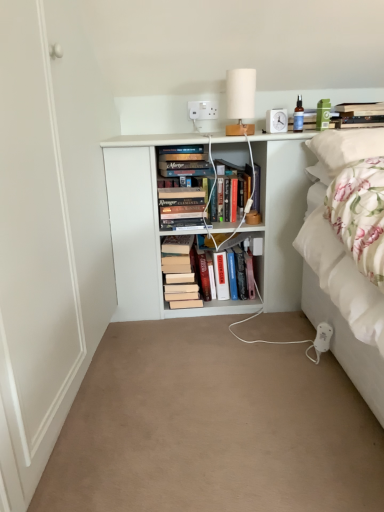
Question: Considering the relative sizes of hardcover book at center, the second book in the top-to-bottom sequence, and white fabric lampshade at upper center in the image provided, is hardcover book at center, the second book in the top-to-bottom sequence, wider than white fabric lampshade at upper center?

Choices:
 (A) yes
 (B) no

Answer: (A)

Question: Is hardcover book at center, the second book in the top-to-bottom sequence, in front of white fabric lampshade at upper center?

Choices:
 (A) no
 (B) yes

Answer: (A)

Question: From the image's perspective, does hardcover book at center, the second book ordered from the bottom, appear higher than white fabric lampshade at upper center?

Choices:
 (A) no
 (B) yes

Answer: (A)

Question: Is white fabric lampshade at upper center at the back of hardcover book at center, the second book ordered from the bottom?

Choices:
 (A) yes
 (B) no

Answer: (B)

Question: From a real-world perspective, is hardcover book at center, the second book in the top-to-bottom sequence, on white fabric lampshade at upper center?

Choices:
 (A) yes
 (B) no

Answer: (B)

Question: In terms of size, does hardcover book at upper right, the third book from the bottom, appear bigger or smaller than white soft pillow at upper right?

Choices:
 (A) small
 (B) big

Answer: (A)

Question: From a real-world perspective, relative to white soft pillow at upper right, is hardcover book at upper right, which ranks as the first book in right-to-left order, vertically above or below?

Choices:
 (A) below
 (B) above

Answer: (B)

Question: From the image's perspective, relative to white soft pillow at upper right, is hardcover book at upper right, marked as the third book in a left-to-right arrangement, above or below?

Choices:
 (A) below
 (B) above

Answer: (B)

Question: In the image, is hardcover book at upper right, marked as the third book in a left-to-right arrangement, positioned in front of or behind white soft pillow at upper right?

Choices:
 (A) front
 (B) behind

Answer: (B)

Question: Is beige carpet at center wider or thinner than white plastic socket at upper center?

Choices:
 (A) wide
 (B) thin

Answer: (A)

Question: Is point (160, 438) closer or farther from the camera than point (196, 104)?

Choices:
 (A) farther
 (B) closer

Answer: (B)

Question: From a real-world perspective, is beige carpet at center positioned above or below white plastic socket at upper center?

Choices:
 (A) above
 (B) below

Answer: (B)

Question: Looking at the image, does beige carpet at center seem bigger or smaller compared to white plastic socket at upper center?

Choices:
 (A) big
 (B) small

Answer: (A)

Question: From a real-world perspective, is white fabric lampshade at upper center physically located above or below hardcover book at upper right, positioned as the 1th book in top-to-bottom order?

Choices:
 (A) below
 (B) above

Answer: (B)

Question: Is white fabric lampshade at upper center bigger or smaller than hardcover book at upper right, which ranks as the first book in right-to-left order?

Choices:
 (A) small
 (B) big

Answer: (B)